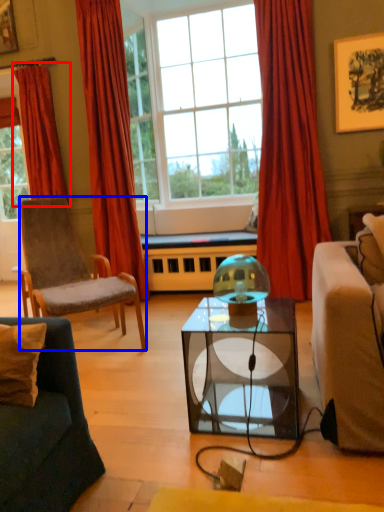
Question: Which object appears closest to the camera in this image, curtain (highlighted by a red box) or chair (highlighted by a blue box)?

Choices:
 (A) curtain
 (B) chair

Answer: (B)